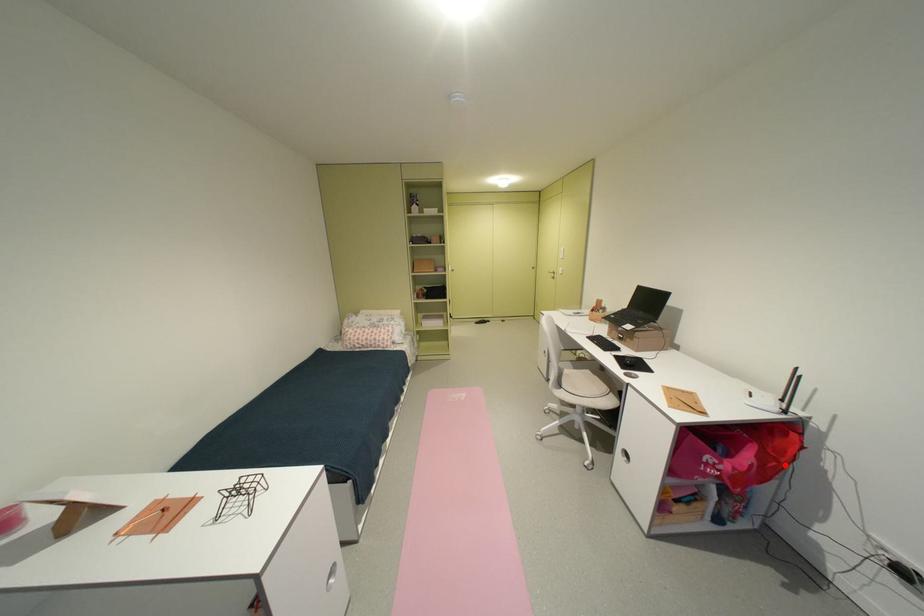
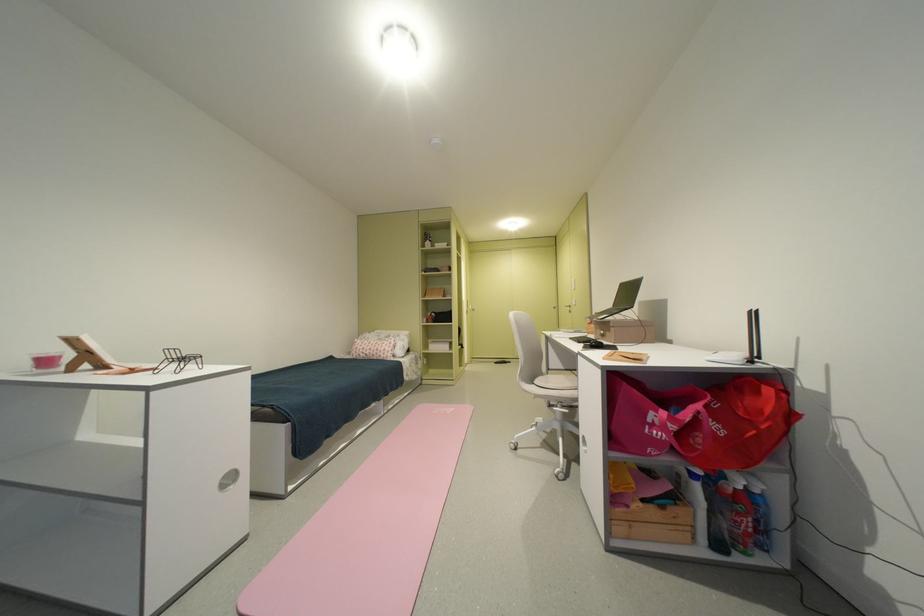
In the second image, find the point that corresponds to the highlighted location in the first image.

(764, 434)